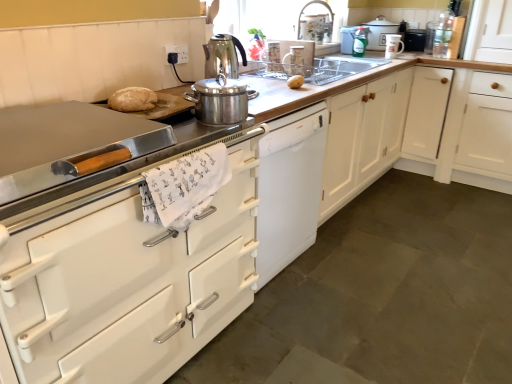
Find the location of a particular element. vacant space to the right of stainless steel kettle at center, which appears as the 2th kitchen appliance when viewed from the front is located at coordinates (265, 84).